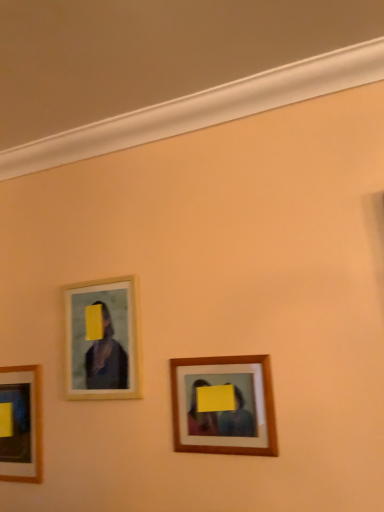
Question: Is wooden frame at upper left, positioned as the second picture frame in front-to-back order, next to wooden frame at center, placed as the third picture frame when sorted from left to right, and touching it?

Choices:
 (A) no
 (B) yes

Answer: (A)

Question: Can you confirm if wooden frame at upper left, the second picture frame when ordered from right to left, is positioned to the right of wooden frame at center, arranged as the 1th picture frame when viewed from the front?

Choices:
 (A) yes
 (B) no

Answer: (B)

Question: Does wooden frame at upper left, the second picture frame when ordered from right to left, have a lesser width compared to wooden frame at center, arranged as the 1th picture frame when viewed from the front?

Choices:
 (A) no
 (B) yes

Answer: (A)

Question: Does wooden frame at upper left, the 2th picture frame when ordered from back to front, appear on the left side of wooden frame at center, acting as the first picture frame starting from the right?

Choices:
 (A) yes
 (B) no

Answer: (A)

Question: Is wooden frame at upper left, which is the 2th picture frame in left-to-right order, shorter than wooden frame at center, arranged as the 1th picture frame when viewed from the front?

Choices:
 (A) no
 (B) yes

Answer: (A)

Question: Based on their positions, is matte wooden picture frame at lower left, placed as the 3th picture frame when sorted from front to back, located to the left or right of wooden frame at upper left, positioned as the second picture frame in front-to-back order?

Choices:
 (A) left
 (B) right

Answer: (A)

Question: Is point (24, 459) positioned closer to the camera than point (119, 309)?

Choices:
 (A) farther
 (B) closer

Answer: (A)

Question: In terms of height, does matte wooden picture frame at lower left, which is counted as the 1th picture frame, starting from the back, look taller or shorter compared to wooden frame at upper left, the second picture frame when ordered from right to left?

Choices:
 (A) tall
 (B) short

Answer: (A)

Question: Which is correct: matte wooden picture frame at lower left, placed as the 3th picture frame when sorted from front to back, is inside wooden frame at upper left, the second picture frame when ordered from right to left, or outside of it?

Choices:
 (A) inside
 (B) outside

Answer: (B)

Question: Based on their positions, is wooden frame at upper left, which is the 2th picture frame in left-to-right order, located to the left or right of matte wooden picture frame at lower left, placed as the 3th picture frame when sorted from front to back?

Choices:
 (A) left
 (B) right

Answer: (B)

Question: In terms of size, does wooden frame at upper left, the second picture frame when ordered from right to left, appear bigger or smaller than matte wooden picture frame at lower left, placed as the 3th picture frame when sorted from front to back?

Choices:
 (A) small
 (B) big

Answer: (A)

Question: From a real-world perspective, is wooden frame at upper left, the second picture frame when ordered from right to left, physically located above or below matte wooden picture frame at lower left, positioned as the 3th picture frame in right-to-left order?

Choices:
 (A) above
 (B) below

Answer: (A)

Question: In the image, is wooden frame at upper left, which is the 2th picture frame in left-to-right order, positioned in front of or behind matte wooden picture frame at lower left, placed as the 3th picture frame when sorted from front to back?

Choices:
 (A) front
 (B) behind

Answer: (A)

Question: From a real-world perspective, is wooden frame at upper left, the 2th picture frame when ordered from back to front, physically located above or below wooden frame at center, placed as the third picture frame when sorted from left to right?

Choices:
 (A) below
 (B) above

Answer: (B)

Question: Is wooden frame at upper left, the 2th picture frame when ordered from back to front, inside the boundaries of wooden frame at center, placed as the third picture frame when sorted from left to right, or outside?

Choices:
 (A) inside
 (B) outside

Answer: (B)